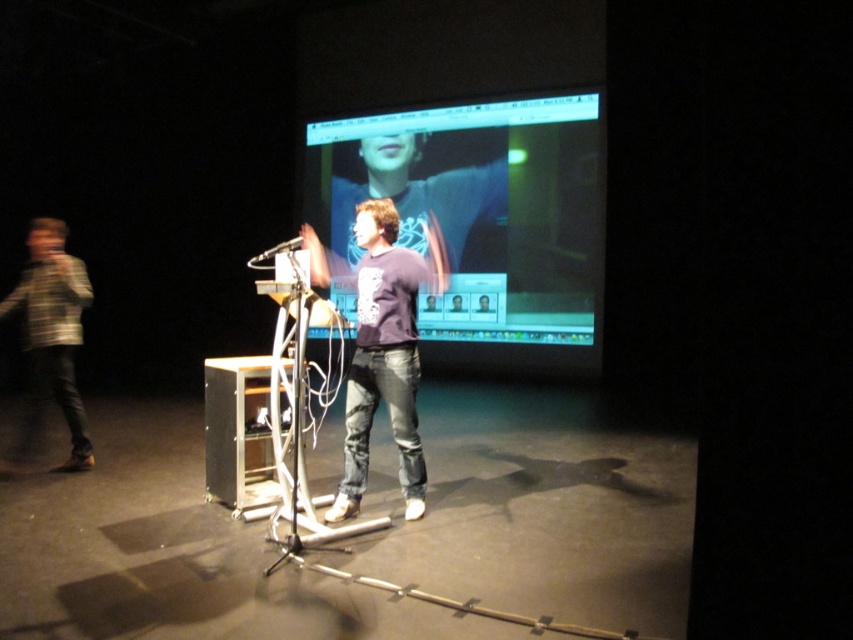
Question: Which of the following is the closest to the observer?

Choices:
 (A) purple cotton shirt at center
 (B) purple matte shirt at center
 (C) metallic silver microphone at center
 (D) striped knit sweater at left

Answer: (A)

Question: Which point is closer to the camera?

Choices:
 (A) (352, 374)
 (B) (474, 211)
 (C) (331, 284)
 (D) (61, 326)

Answer: (A)

Question: Among these objects, which one is farthest from the camera?

Choices:
 (A) purple cotton shirt at center
 (B) metallic silver microphone at center

Answer: (B)

Question: Is striped knit sweater at left smaller than metallic silver microphone at center?

Choices:
 (A) no
 (B) yes

Answer: (B)

Question: Is striped knit sweater at left to the left of metallic silver microphone at center from the viewer's perspective?

Choices:
 (A) yes
 (B) no

Answer: (A)

Question: Can you confirm if purple matte shirt at center is smaller than metallic silver microphone at center?

Choices:
 (A) no
 (B) yes

Answer: (B)